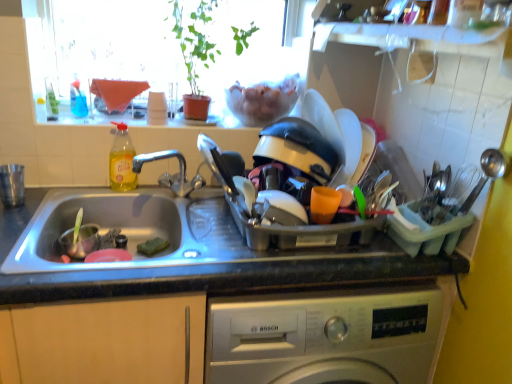
This screenshot has height=384, width=512. In order to click on vacant area that is situated to the right of yellow translucent bottle at sink left in this screenshot , I will do `click(165, 189)`.